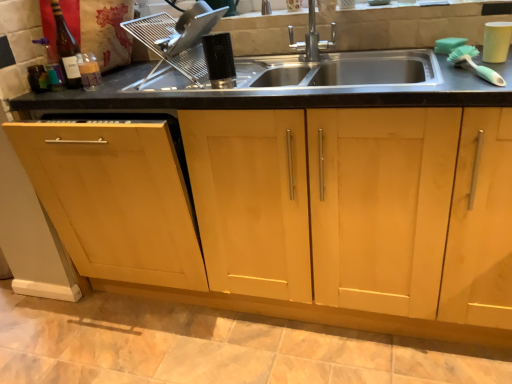
Locate an element on the screen. This screenshot has height=384, width=512. free space in front of black plastic comb at center, positioned as the 2th appliance in left-to-right order is located at coordinates (221, 89).